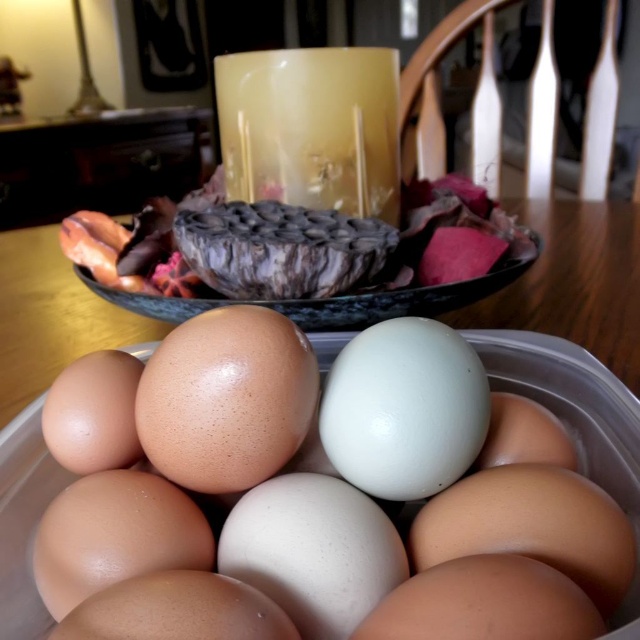
How distant is matte brown egg at center from brown matte egg at center?

matte brown egg at center and brown matte egg at center are 2.00 inches apart.

Which is more to the left, matte brown egg at center or brown matte egg at center?

brown matte egg at center is more to the left.

Is point (509, 593) positioned behind point (291, 406)?

No, (509, 593) is in front of (291, 406).

The image size is (640, 640). Find the location of `matte brown egg at center`. matte brown egg at center is located at coordinates (292, 481).

Can you confirm if translucent glass candle at center is bigger than matte yellow candle at upper center?

Correct, translucent glass candle at center is larger in size than matte yellow candle at upper center.

Locate an element on the screen. translucent glass candle at center is located at coordinates (310, 128).

Where is `translucent glass candle at center`? translucent glass candle at center is located at coordinates (310, 128).

Is translucent glass candle at center behind brown matte egg at center?

Yes, translucent glass candle at center is behind brown matte egg at center.

Is translucent glass candle at center to the right of brown matte egg at center from the viewer's perspective?

Indeed, translucent glass candle at center is positioned on the right side of brown matte egg at center.

Who is more distant from viewer, (371, 54) or (307, 433)?

Positioned behind is point (371, 54).

Identify the location of translucent glass candle at center. (310, 128).